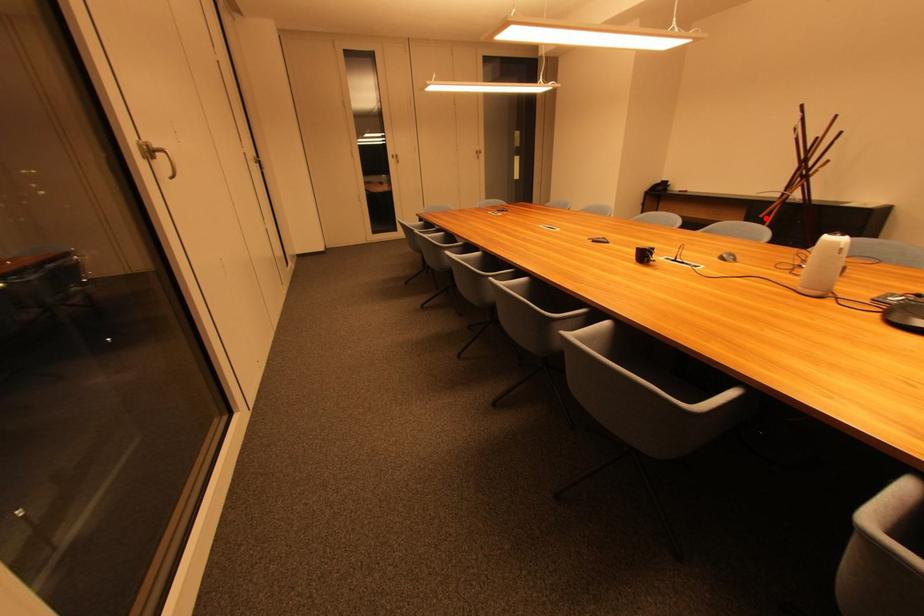
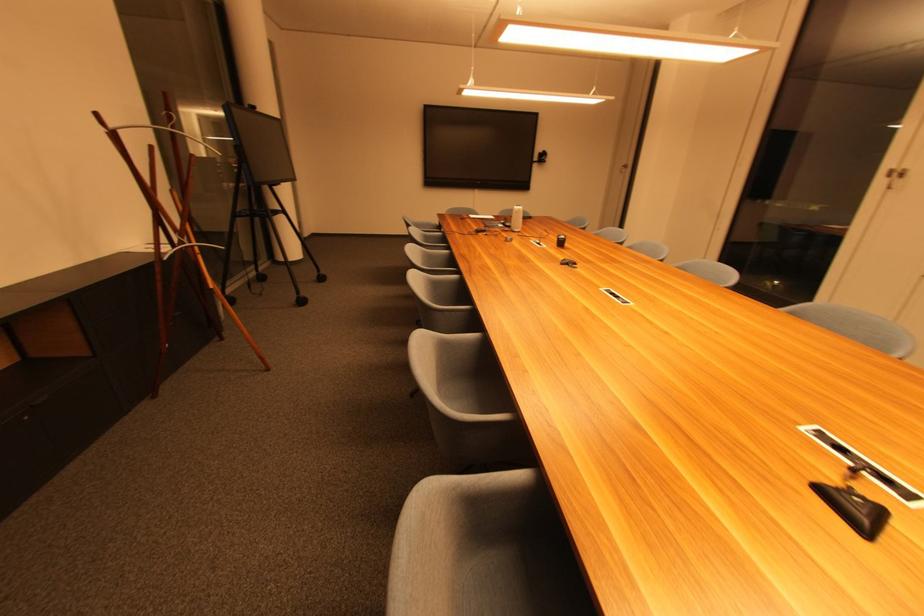
Locate, in the second image, the point that corresponds to the highlighted location in the first image.

(216, 288)